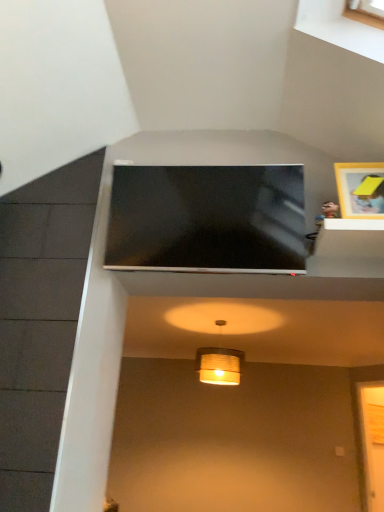
Question: Based on their sizes in the image, would you say matte yellow paper lampshade at center is bigger or smaller than matte black tv at upper center?

Choices:
 (A) big
 (B) small

Answer: (B)

Question: Is matte yellow paper lampshade at center in front of or behind matte black tv at upper center in the image?

Choices:
 (A) front
 (B) behind

Answer: (B)

Question: Which object is the farthest from the matte yellow paper lampshade at center?

Choices:
 (A) transparent glass door at lower right
 (B) wooden picture frame at upper right
 (C) matte black tv at upper center

Answer: (B)

Question: Which object is positioned farthest from the matte yellow paper lampshade at center?

Choices:
 (A) transparent glass door at lower right
 (B) matte black tv at upper center
 (C) wooden picture frame at upper right

Answer: (C)